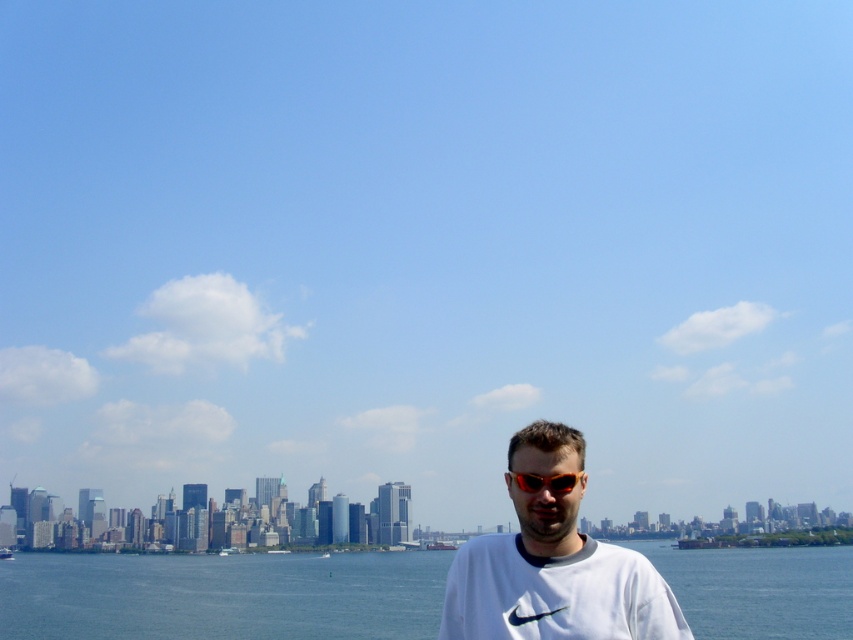
You are a photographer trying to capture the reflection of the city skyline in the blue water at lower center. However, the orange reflective sunglasses at center might be blocking the view. Can you determine if the sunglasses are in the way of the reflection?

The blue water at lower center is positioned under orange reflective sunglasses at center, so the sunglasses are blocking the reflection of the city skyline in the water.